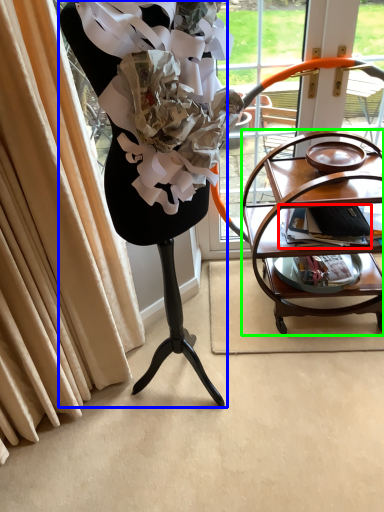
Question: Which object is positioned closest to magazine (highlighted by a red box)? Select from furniture (highlighted by a blue box) and table (highlighted by a green box).

Choices:
 (A) furniture
 (B) table

Answer: (B)